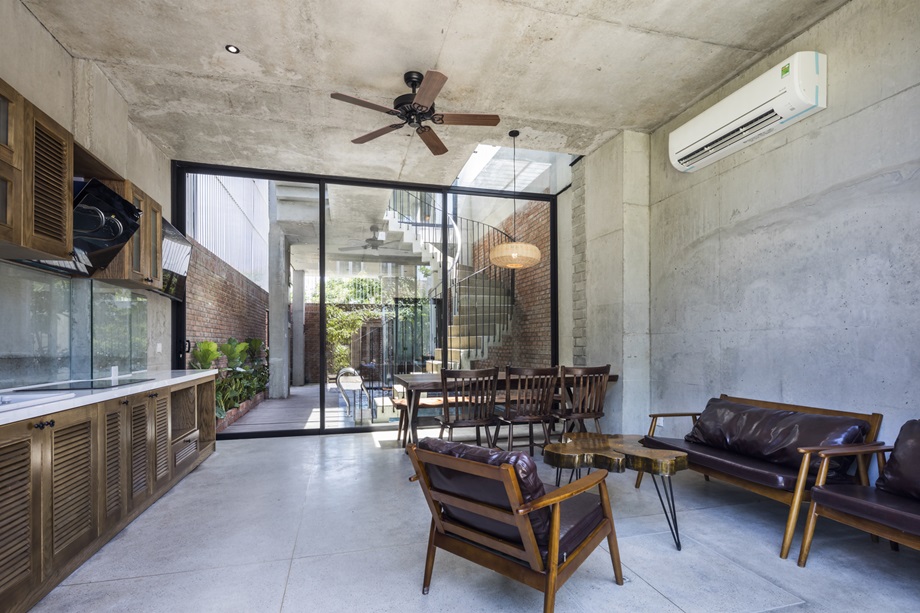
Identify the location of couch cushions. (786, 431), (730, 419), (715, 451), (740, 465).